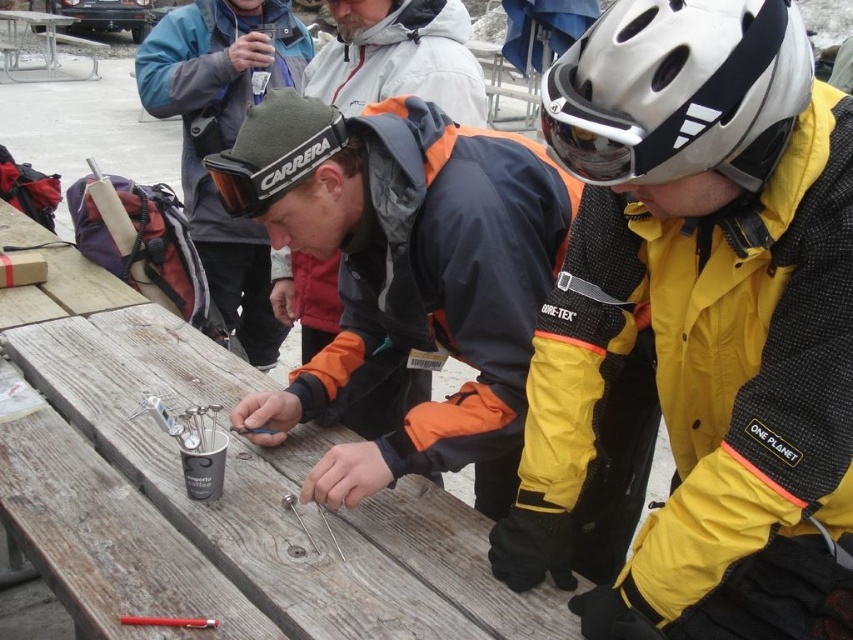
You are a photographer trying to capture a clear photo of the orange and black jacket at center and the black matte goggles at center. If you want to ensure both are fully visible in the frame without cropping, which object should you position closer to the edge of the frame?

The orange and black jacket at center might be wider than black matte goggles at center, so you should position the orange and black jacket at center closer to the edge of the frame to ensure both fit without cropping.

You are a photographer standing at the back of the scene. You want to take a photo of the wooden table at center and the white matte bicycle helmet at upper center. Which object will appear larger in the photo?

The wooden table at center will appear larger in the photo because it is much taller than the white matte bicycle helmet at upper center.